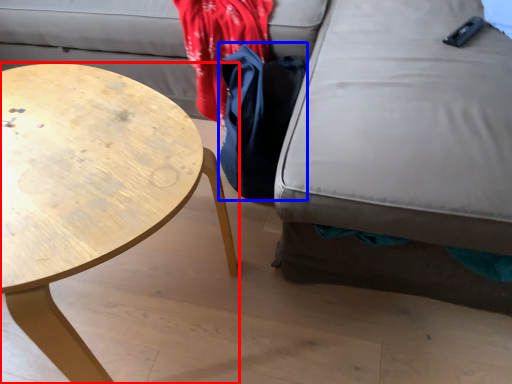
Question: Which of the following is the farthest to the observer, coffee table (highlighted by a red box) or cloak (highlighted by a blue box)?

Choices:
 (A) coffee table
 (B) cloak

Answer: (B)